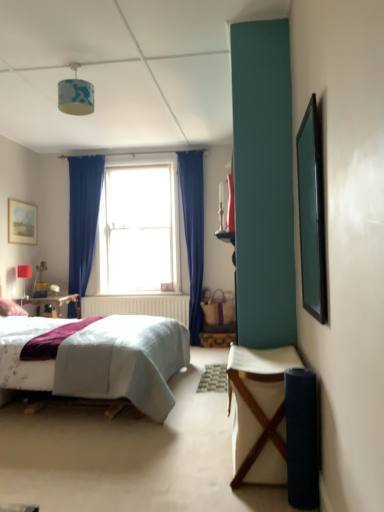
Measure the distance between wooden stool at center and camera.

The distance of wooden stool at center from camera is 5.18 meters.

This screenshot has height=512, width=384. Describe the element at coordinates (259, 412) in the screenshot. I see `white fabric desk at lower right` at that location.

What do you see at coordinates (312, 213) in the screenshot?
I see `green matte picture frame at right, arranged as the first picture frame when viewed from the front` at bounding box center [312, 213].

Where is `wooden stool at center`? Image resolution: width=384 pixels, height=512 pixels. wooden stool at center is located at coordinates (216, 339).

Is brown woven picnic basket at center-right turned away from white fabric desk at lower right?

No, white fabric desk at lower right is not at the back of brown woven picnic basket at center-right.

Who is taller, brown woven picnic basket at center-right or white fabric desk at lower right?

With more height is white fabric desk at lower right.

Considering the sizes of objects brown woven picnic basket at center-right and white fabric desk at lower right in the image provided, who is thinner, brown woven picnic basket at center-right or white fabric desk at lower right?

brown woven picnic basket at center-right.

Can you tell me how much brown woven picnic basket at center-right and white fabric desk at lower right differ in facing direction?

The facing directions of brown woven picnic basket at center-right and white fabric desk at lower right are 90 degrees apart.

Based on the photo, could you tell me if wooden stool at center is turned towards white fabric desk at lower right?

Yes, wooden stool at center is facing white fabric desk at lower right.

Considering the relative positions of wooden stool at center and white fabric desk at lower right in the image provided, is wooden stool at center to the right of white fabric desk at lower right from the viewer's perspective?

Incorrect, wooden stool at center is not on the right side of white fabric desk at lower right.

From the image's perspective, is wooden stool at center positioned above or below white fabric desk at lower right?

From the image's perspective, wooden stool at center appears below white fabric desk at lower right.

Consider the image. Which is farther, (202, 343) or (253, 470)?

The point (202, 343) is farther from the camera.

Considering the sizes of objects white fabric desk at lower right and brown woven picnic basket at center-right in the image provided, who is taller, white fabric desk at lower right or brown woven picnic basket at center-right?

Standing taller between the two is white fabric desk at lower right.

Is white fabric desk at lower right placed right next to brown woven picnic basket at center-right?

No, white fabric desk at lower right is not in contact with brown woven picnic basket at center-right.

Is white fabric desk at lower right located outside brown woven picnic basket at center-right?

That's correct, white fabric desk at lower right is outside of brown woven picnic basket at center-right.

Does white fabric desk at lower right have a larger size compared to brown woven picnic basket at center-right?

Indeed, white fabric desk at lower right has a larger size compared to brown woven picnic basket at center-right.

Which object is more forward, green matte picture frame at right, placed as the second picture frame when sorted from left to right, or matte red lampshade at upper left, the 2th lamp from the front?

green matte picture frame at right, placed as the second picture frame when sorted from left to right, is closer to the camera.

Based on the photo, between green matte picture frame at right, positioned as the second picture frame in back-to-front order, and matte red lampshade at upper left, which is the 2th lamp in right-to-left order, which one has less height?

With less height is matte red lampshade at upper left, which is the 2th lamp in right-to-left order.

Does point (314, 190) come closer to viewer compared to point (21, 273)?

Yes, it is.

From a real-world perspective, which object stands above the other?

green matte picture frame at right, which is the first picture frame in right-to-left order, from a real-world perspective.

Which is more to the left, clear glass window at center or wooden stool at center?

Positioned to the left is clear glass window at center.

Which is in front, clear glass window at center or wooden stool at center?

wooden stool at center.

You are a GUI agent. You are given a task and a screenshot of the screen. Output one action in this format:
    pyautogui.click(x=<x>, y=<y>)
    Task: Click on the stool in front of the clear glass window at center
    The image size is (384, 512).
    Given the screenshot: What is the action you would take?
    pyautogui.click(x=216, y=339)

Consider the image. How far apart are clear glass window at center and wooden stool at center?

clear glass window at center is 1.59 meters away from wooden stool at center.

Is matte wooden picture frame at upper left, the first picture frame in the left-to-right sequence, located outside matte red lampshade at upper left, arranged as the first lamp when viewed from the left?

Yes, matte wooden picture frame at upper left, the first picture frame in the left-to-right sequence, is not within matte red lampshade at upper left, arranged as the first lamp when viewed from the left.

Could you tell me if matte wooden picture frame at upper left, the 2th picture frame positioned from the right, is turned towards matte red lampshade at upper left, the 2th lamp from the front?

→ No, matte wooden picture frame at upper left, the 2th picture frame positioned from the right, is not oriented towards matte red lampshade at upper left, the 2th lamp from the front.

Are matte wooden picture frame at upper left, the 2th picture frame positioned from the right, and matte red lampshade at upper left, acting as the 1th lamp starting from the back, making contact?

No, matte wooden picture frame at upper left, the 2th picture frame positioned from the right, is not next to matte red lampshade at upper left, acting as the 1th lamp starting from the back.

Does matte wooden picture frame at upper left, the 2th picture frame positioned from the right, have a greater width compared to matte red lampshade at upper left, acting as the 1th lamp starting from the back?

No, matte wooden picture frame at upper left, the 2th picture frame positioned from the right, is not wider than matte red lampshade at upper left, acting as the 1th lamp starting from the back.

Is wooden stool at center thinner than matte wooden picture frame at upper left, the first picture frame in the left-to-right sequence?

In fact, wooden stool at center might be wider than matte wooden picture frame at upper left, the first picture frame in the left-to-right sequence.

Is wooden stool at center facing away from matte wooden picture frame at upper left, which is the 1th picture frame in back-to-front order?

No, matte wooden picture frame at upper left, which is the 1th picture frame in back-to-front order, is not at the back of wooden stool at center.

How many degrees apart are the facing directions of wooden stool at center and matte wooden picture frame at upper left, the 2th picture frame positioned from the right?

They differ by 90.2 degrees in their facing directions.

From a real-world perspective, between wooden stool at center and matte wooden picture frame at upper left, which is the 1th picture frame in back-to-front order, who is vertically lower?

In real-world perspective, wooden stool at center is lower.

The width and height of the screenshot is (384, 512). What are the coordinates of `picnic basket above the white fabric desk at lower right (from a real-world perspective)` in the screenshot? It's located at (219, 308).

Find the location of a particular element. stool behind the white fabric desk at lower right is located at coordinates (216, 339).

Based on their spatial positions, is wooden stool at center or green matte picture frame at right, positioned as the second picture frame in back-to-front order, closer to white fabric desk at lower right?

green matte picture frame at right, positioned as the second picture frame in back-to-front order, is positioned closer to the anchor white fabric desk at lower right.

Estimate the real-world distances between objects in this image. Which object is further from green matte picture frame at right, which is the first picture frame in right-to-left order, clear glass window at center or white fabric desk at lower right?

clear glass window at center is positioned further to the anchor green matte picture frame at right, which is the first picture frame in right-to-left order.

From the image, which object appears to be nearer to green matte picture frame at right, positioned as the second picture frame in back-to-front order, blue fabric lampshade at upper center, which is counted as the first lamp, starting from the front, or matte red lampshade at upper left, acting as the 1th lamp starting from the back?

The object closer to green matte picture frame at right, positioned as the second picture frame in back-to-front order, is blue fabric lampshade at upper center, which is counted as the first lamp, starting from the front.

From the image, which object appears to be farther from green matte picture frame at right, positioned as the second picture frame in back-to-front order, brown woven picnic basket at center-right or wooden stool at center?

wooden stool at center.

Based on their spatial positions, is clear glass window at center or green matte picture frame at right, positioned as the second picture frame in back-to-front order, further from wooden stool at center?

green matte picture frame at right, positioned as the second picture frame in back-to-front order.

Which object lies further to the anchor point white fabric desk at lower right, matte wooden picture frame at upper left, the first picture frame in the left-to-right sequence, or matte red lampshade at upper left, marked as the second lamp in a top-to-bottom arrangement?

matte wooden picture frame at upper left, the first picture frame in the left-to-right sequence, is positioned further to the anchor white fabric desk at lower right.

From the image, which object appears to be nearer to matte wooden picture frame at upper left, positioned as the second picture frame in front-to-back order, brown woven picnic basket at center-right or blue fabric lampshade at upper center, which is the 2th lamp from left to right?

blue fabric lampshade at upper center, which is the 2th lamp from left to right, lies closer to matte wooden picture frame at upper left, positioned as the second picture frame in front-to-back order, than the other object.

Considering their positions, is wooden stool at center positioned closer to blue fabric lampshade at upper center, the 2th lamp in the bottom-to-top sequence, than brown woven picnic basket at center-right?

The object closer to blue fabric lampshade at upper center, the 2th lamp in the bottom-to-top sequence, is brown woven picnic basket at center-right.

The image size is (384, 512). What are the coordinates of `window between matte red lampshade at upper left, marked as the second lamp in a top-to-bottom arrangement, and wooden stool at center, in the horizontal direction` in the screenshot? It's located at (138, 229).

The image size is (384, 512). I want to click on picture frame positioned between blue fabric lampshade at upper center, which appears as the second lamp when viewed from the back, and clear glass window at center from near to far, so click(22, 222).

The height and width of the screenshot is (512, 384). In order to click on stool between matte wooden picture frame at upper left, which is the 1th picture frame in back-to-front order, and brown woven picnic basket at center-right from left to right in this screenshot , I will do `click(216, 339)`.

This screenshot has height=512, width=384. I want to click on picture frame positioned between white fabric desk at lower right and clear glass window at center from near to far, so click(x=22, y=222).